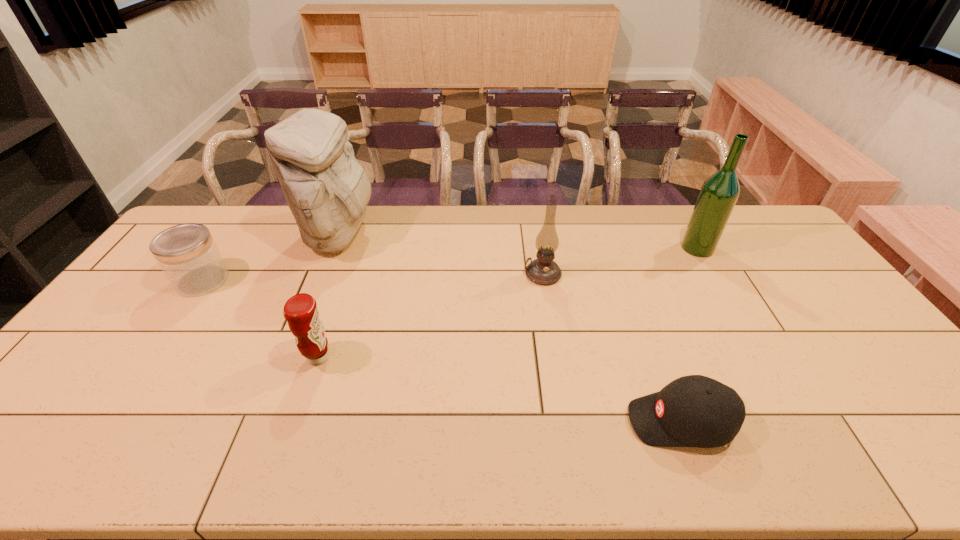
This screenshot has width=960, height=540. Identify the location of object that is at the near edge. (697, 411).

I want to click on object that is at the left edge, so click(187, 254).

Identify the location of free region at the far edge of the desktop. (402, 207).

You are a GUI agent. You are given a task and a screenshot of the screen. Output one action in this format:
    pyautogui.click(x=<x>, y=<y>)
    Task: Click on the free space at the right edge of the desktop
    This screenshot has height=540, width=960.
    Given the screenshot: What is the action you would take?
    pyautogui.click(x=779, y=284)

I want to click on free space at the far left corner, so click(227, 208).

Locate an element on the screen. The image size is (960, 540). free area in between the alcohol and the backpack is located at coordinates (518, 241).

Where is `empty space that is in between the alcohol and the backpack`? This screenshot has height=540, width=960. empty space that is in between the alcohol and the backpack is located at coordinates (518, 241).

Identify the location of vacant space in between the third tallest object and the nearest object. point(612,348).

You are a GUI agent. You are given a task and a screenshot of the screen. Output one action in this format:
    pyautogui.click(x=<x>, y=<y>)
    Task: Click on the unoccupied position between the third shortest object and the backpack
    
    Given the screenshot: What is the action you would take?
    pyautogui.click(x=329, y=296)

Find the location of a particular element. vacant space that is in between the backpack and the fifth tallest object is located at coordinates (271, 258).